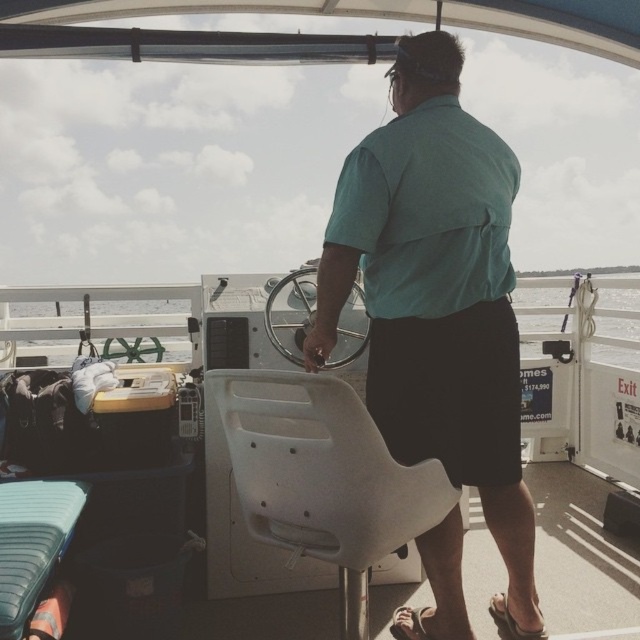
Is clear water at center above brown suede sandal at lower right?

Yes, clear water at center is above brown suede sandal at lower right.

Who is taller, clear water at center or brown suede sandal at lower right?

Standing taller between the two is clear water at center.

Is point (100, 300) positioned before point (493, 605)?

No, it is not.

Where is `clear water at center`? The width and height of the screenshot is (640, 640). clear water at center is located at coordinates (96, 292).

This screenshot has height=640, width=640. What do you see at coordinates (436, 292) in the screenshot?
I see `teal shirt at center` at bounding box center [436, 292].

This screenshot has height=640, width=640. In order to click on teal shirt at center in this screenshot , I will do `click(436, 292)`.

The image size is (640, 640). Identify the location of teal shirt at center. (436, 292).

Who is taller, clear water at center or brown leather sandal at lower right?

Standing taller between the two is clear water at center.

Which is in front, point (102, 289) or point (422, 612)?

Point (422, 612) is in front.

Identify the location of clear water at center. The height and width of the screenshot is (640, 640). (96, 292).